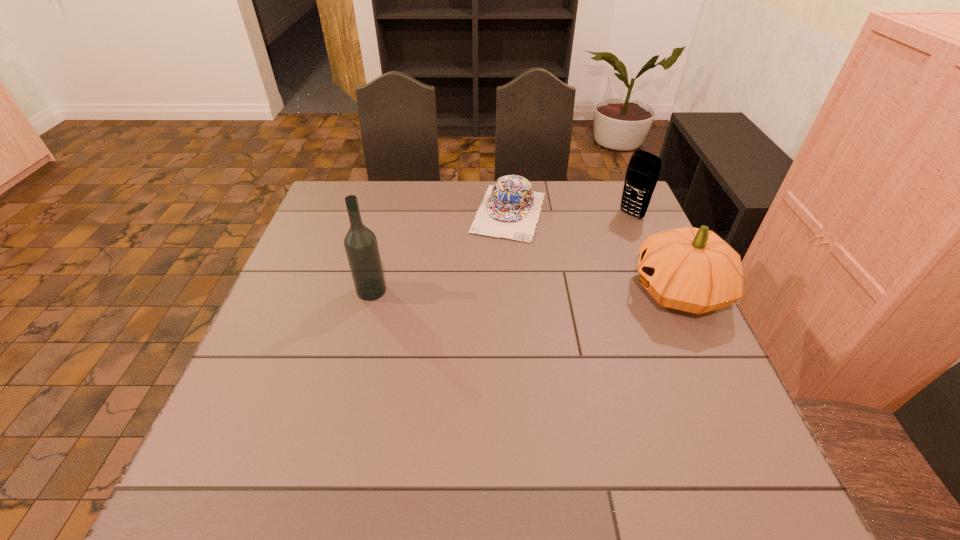
The width and height of the screenshot is (960, 540). I want to click on object located at the far right corner, so click(642, 174).

This screenshot has height=540, width=960. I want to click on blank space at the far edge, so click(x=439, y=181).

Find the location of a particular element. free location at the left edge of the desktop is located at coordinates (303, 262).

Image resolution: width=960 pixels, height=540 pixels. In the image, there is a desktop. What are the coordinates of `vacant space at the right edge` in the screenshot? It's located at pyautogui.click(x=645, y=343).

Identify the location of vacant space at the far right corner of the desktop. The width and height of the screenshot is (960, 540). (584, 194).

Identify the location of free space between the tallest object and the cap. The width and height of the screenshot is (960, 540). (441, 252).

This screenshot has height=540, width=960. I want to click on vacant region between the cellular telephone and the shortest object, so click(x=570, y=214).

Find the location of `free area in between the leftmost object and the cellular telephone`. free area in between the leftmost object and the cellular telephone is located at coordinates (501, 253).

The image size is (960, 540). Identify the location of vacant space that is in between the cap and the gourd. (594, 252).

Locate an element on the screen. This screenshot has width=960, height=540. free space between the cellular telephone and the vodka is located at coordinates (501, 253).